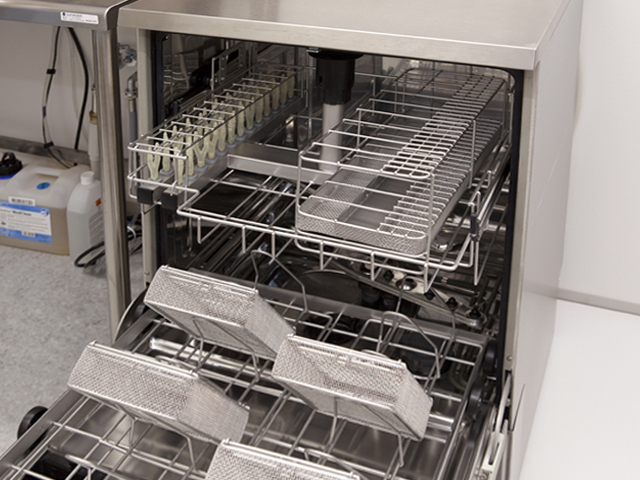
Identify the location of wall. (584, 195).